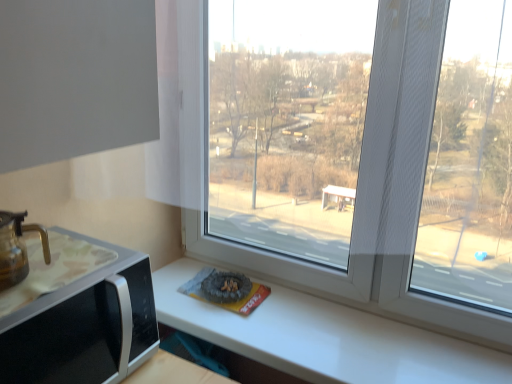
Question: Is translucent glass coffeepot at lower left turned away from black plastic microwave at lower left?

Choices:
 (A) yes
 (B) no

Answer: (B)

Question: From the image's perspective, would you say translucent glass coffeepot at lower left is shown under black plastic microwave at lower left?

Choices:
 (A) no
 (B) yes

Answer: (A)

Question: Is black plastic microwave at lower left completely or partially inside translucent glass coffeepot at lower left?

Choices:
 (A) yes
 (B) no

Answer: (B)

Question: Is translucent glass coffeepot at lower left closer to the viewer compared to black plastic microwave at lower left?

Choices:
 (A) no
 (B) yes

Answer: (A)

Question: Considering the relative sizes of translucent glass coffeepot at lower left and black plastic microwave at lower left in the image provided, is translucent glass coffeepot at lower left thinner than black plastic microwave at lower left?

Choices:
 (A) no
 (B) yes

Answer: (B)

Question: Is translucent glass coffeepot at lower left completely or partially outside of black plastic microwave at lower left?

Choices:
 (A) yes
 (B) no

Answer: (A)

Question: Does black plastic microwave at lower left have a greater width compared to translucent glass coffeepot at lower left?

Choices:
 (A) yes
 (B) no

Answer: (A)

Question: Considering the relative sizes of black plastic microwave at lower left and translucent glass coffeepot at lower left in the image provided, is black plastic microwave at lower left taller than translucent glass coffeepot at lower left?

Choices:
 (A) yes
 (B) no

Answer: (A)

Question: Is black plastic microwave at lower left closer to camera compared to translucent glass coffeepot at lower left?

Choices:
 (A) no
 (B) yes

Answer: (B)

Question: From a real-world perspective, is black plastic microwave at lower left physically below translucent glass coffeepot at lower left?

Choices:
 (A) yes
 (B) no

Answer: (A)

Question: Can you confirm if black plastic microwave at lower left is positioned to the right of translucent glass coffeepot at lower left?

Choices:
 (A) no
 (B) yes

Answer: (B)

Question: Can you confirm if black plastic microwave at lower left is bigger than translucent glass coffeepot at lower left?

Choices:
 (A) yes
 (B) no

Answer: (A)

Question: In terms of width, does translucent glass coffeepot at lower left look wider or thinner when compared to black plastic microwave at lower left?

Choices:
 (A) wide
 (B) thin

Answer: (B)